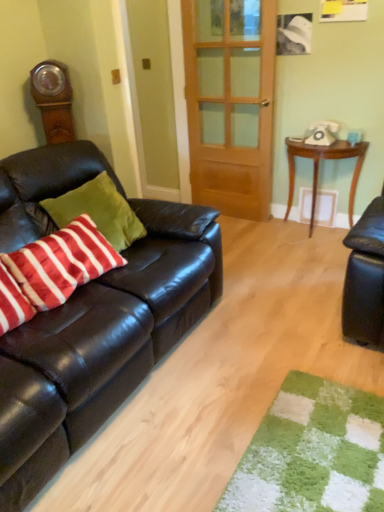
This screenshot has width=384, height=512. What do you see at coordinates (102, 344) in the screenshot?
I see `matte black couch at left` at bounding box center [102, 344].

In the scene shown: What is the approximate width of wooden door at center?

The width of wooden door at center is 3.49 inches.

What do you see at coordinates (12, 303) in the screenshot? Image resolution: width=384 pixels, height=512 pixels. I see `striped cotton pillow at left, positioned as the second pillow in right-to-left order` at bounding box center [12, 303].

What is the approximate width of wooden table at right?

The width of wooden table at right is 12.42 inches.

Where is `matte black couch at left`? matte black couch at left is located at coordinates (102, 344).

Between point (40, 245) and point (312, 129), which one is positioned in front?

The point (40, 245) is closer.

Consider the image. Is velvety red and white striped pillow at left, which ranks as the 2th pillow in left-to-right order, completely or partially outside of white plastic phone at upper right?

Yes, velvety red and white striped pillow at left, which ranks as the 2th pillow in left-to-right order, is not within white plastic phone at upper right.

Could you tell me if velvety red and white striped pillow at left, the first pillow viewed from the right, is facing white plastic phone at upper right?

No, velvety red and white striped pillow at left, the first pillow viewed from the right, does not turn towards white plastic phone at upper right.

I want to click on corded phone lying on the right of velvety red and white striped pillow at left, which ranks as the 2th pillow in left-to-right order, so click(x=322, y=133).

The width and height of the screenshot is (384, 512). In order to click on corded phone that is on the left side of wooden table at right in this screenshot , I will do `click(322, 133)`.

Is wooden table at right taller than white plastic phone at upper right?

Indeed, wooden table at right has a greater height compared to white plastic phone at upper right.

Considering the relative positions of wooden table at right and white plastic phone at upper right in the image provided, is wooden table at right to the right of white plastic phone at upper right from the viewer's perspective?

Yes, wooden table at right is to the right of white plastic phone at upper right.

Is wooden table at right in contact with white plastic phone at upper right?

wooden table at right is not next to white plastic phone at upper right, and they're not touching.

The width and height of the screenshot is (384, 512). What are the coordinates of `corded phone lying behind the matte black couch at left` in the screenshot? It's located at (322, 133).

Is matte black couch at left in contact with white plastic phone at upper right?

No, matte black couch at left is not with white plastic phone at upper right.

How distant is matte black couch at left from white plastic phone at upper right?

6.08 feet.

In the image, is matte black couch at left positioned in front of or behind white plastic phone at upper right?

matte black couch at left is in front of white plastic phone at upper right.

Consider the image. Is wooden door at center closer to the viewer compared to matte black couch at left?

No, wooden door at center is further to the viewer.

From the image's perspective, would you say wooden door at center is shown under matte black couch at left?

No.

Is wooden door at center turned away from matte black couch at left?

wooden door at center does not have its back to matte black couch at left.

From a real-world perspective, who is located lower, wooden door at center or matte black couch at left?

From a 3D spatial view, matte black couch at left is below.

Which is more to the left, wooden door at center or white plastic phone at upper right?

From the viewer's perspective, wooden door at center appears more on the left side.

From the image's perspective, is wooden door at center on top of white plastic phone at upper right?

Indeed, from the image's perspective, wooden door at center is shown above white plastic phone at upper right.

Is wooden door at center positioned beyond the bounds of white plastic phone at upper right?

Absolutely, wooden door at center is external to white plastic phone at upper right.

Does wooden door at center come behind velvety red and white striped pillow at left, the first pillow viewed from the right?

Yes, wooden door at center is further from the viewer.

Considering the sizes of objects wooden door at center and velvety red and white striped pillow at left, which ranks as the 2th pillow in left-to-right order, in the image provided, who is smaller, wooden door at center or velvety red and white striped pillow at left, which ranks as the 2th pillow in left-to-right order,?

Smaller between the two is velvety red and white striped pillow at left, which ranks as the 2th pillow in left-to-right order.

From a real-world perspective, is wooden door at center positioned above or below velvety red and white striped pillow at left, which ranks as the 2th pillow in left-to-right order?

wooden door at center is above velvety red and white striped pillow at left, which ranks as the 2th pillow in left-to-right order.

How many degrees apart are the facing directions of white plastic phone at upper right and matte black couch at left?

The angular difference between white plastic phone at upper right and matte black couch at left is 95.9 degrees.

Looking at this image, from a real-world perspective, is white plastic phone at upper right on top of matte black couch at left?

Correct, in the physical world, white plastic phone at upper right is higher than matte black couch at left.

How far apart are white plastic phone at upper right and matte black couch at left?

1.85 meters.

Is white plastic phone at upper right far away from matte black couch at left?

That's right, there is a large distance between white plastic phone at upper right and matte black couch at left.

Find the location of a particular element. This screenshot has width=384, height=512. corded phone located above the velvety red and white striped pillow at left, the first pillow viewed from the right (from the image's perspective) is located at coordinates (322, 133).

Find the location of a particular element. table below the white plastic phone at upper right (from the image's perspective) is located at coordinates (318, 168).

Looking at the image, which one is located closer to wooden table at right, white plastic phone at upper right or striped cotton pillow at left, positioned as the second pillow in right-to-left order?

white plastic phone at upper right is closer to wooden table at right.

When comparing their distances from white plastic phone at upper right, does wooden table at right or velvety red and white striped pillow at left, which ranks as the 2th pillow in left-to-right order, seem closer?

wooden table at right is positioned closer to the anchor white plastic phone at upper right.

In the scene shown: Looking at the image, which one is located closer to striped cotton pillow at left, arranged as the first pillow when viewed from the left, wooden table at right or wooden door at center?

Based on the image, wooden table at right appears to be nearer to striped cotton pillow at left, arranged as the first pillow when viewed from the left.

Looking at this image, looking at the image, which one is located closer to striped cotton pillow at left, positioned as the second pillow in right-to-left order, wooden door at center or wooden table at right?

wooden table at right is closer to striped cotton pillow at left, positioned as the second pillow in right-to-left order.

Which object lies further to the anchor point striped cotton pillow at left, arranged as the first pillow when viewed from the left, velvety red and white striped pillow at left, which ranks as the 2th pillow in left-to-right order, or wooden table at right?

The object further to striped cotton pillow at left, arranged as the first pillow when viewed from the left, is wooden table at right.

Looking at the image, which one is located closer to striped cotton pillow at left, positioned as the second pillow in right-to-left order, wooden door at center or matte black couch at left?

matte black couch at left.

Estimate the real-world distances between objects in this image. Which object is further from matte black couch at left, wooden table at right or velvety red and white striped pillow at left, the first pillow viewed from the right?

The object further to matte black couch at left is wooden table at right.

Estimate the real-world distances between objects in this image. Which object is further from velvety red and white striped pillow at left, the first pillow viewed from the right, wooden table at right or wooden door at center?

wooden table at right is further to velvety red and white striped pillow at left, the first pillow viewed from the right.

Locate an element on the screen. The image size is (384, 512). pillow located between striped cotton pillow at left, positioned as the second pillow in right-to-left order, and wooden table at right in the left-right direction is located at coordinates (60, 264).

This screenshot has height=512, width=384. Find the location of `door between matte black couch at left and white plastic phone at upper right in the front-back direction`. door between matte black couch at left and white plastic phone at upper right in the front-back direction is located at coordinates (230, 102).

Find the location of `door between striped cotton pillow at left, positioned as the second pillow in right-to-left order, and white plastic phone at upper right`. door between striped cotton pillow at left, positioned as the second pillow in right-to-left order, and white plastic phone at upper right is located at coordinates (230, 102).

At what (x,y) coordinates should I click in order to perform the action: click on door between velvety red and white striped pillow at left, the first pillow viewed from the right, and white plastic phone at upper right from front to back. Please return your answer as a coordinate pair (x, y). The image size is (384, 512). Looking at the image, I should click on (230, 102).